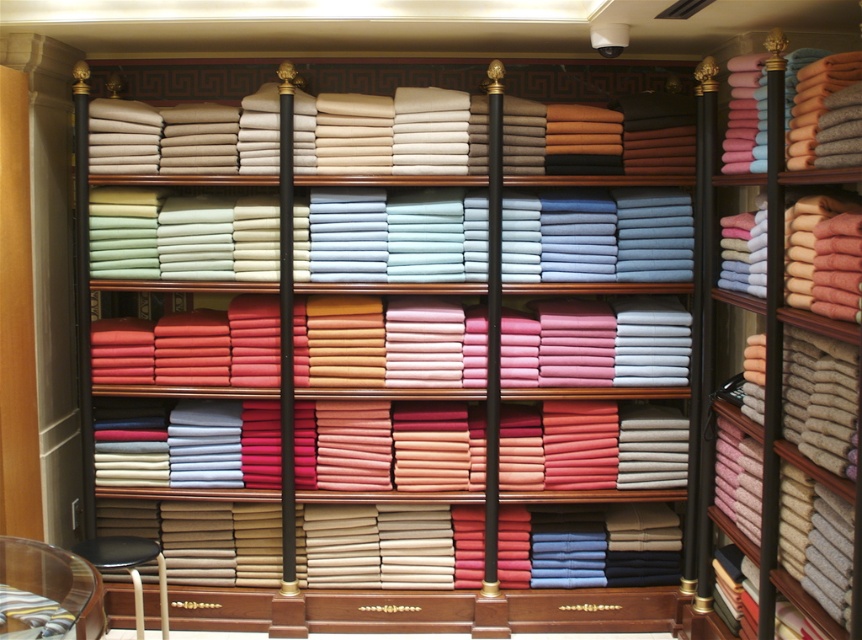
Question: Can you confirm if soft woolen towels at right is wider than black leather stool at lower left?

Choices:
 (A) yes
 (B) no

Answer: (B)

Question: Observing the image, what is the correct spatial positioning of soft woolen towels at right in reference to black leather stool at lower left?

Choices:
 (A) above
 (B) below

Answer: (A)

Question: Which of the following is the farthest from the observer?

Choices:
 (A) (163, 586)
 (B) (91, 608)
 (C) (838, 173)

Answer: (A)

Question: Which of the following is the closest to the observer?

Choices:
 (A) black leather stool at lower left
 (B) soft woolen towels at right
 (C) transparent glass table at lower left

Answer: (C)

Question: Which point is closer to the camera?

Choices:
 (A) transparent glass table at lower left
 (B) black leather stool at lower left

Answer: (A)

Question: Is transparent glass table at lower left smaller than black leather stool at lower left?

Choices:
 (A) no
 (B) yes

Answer: (B)